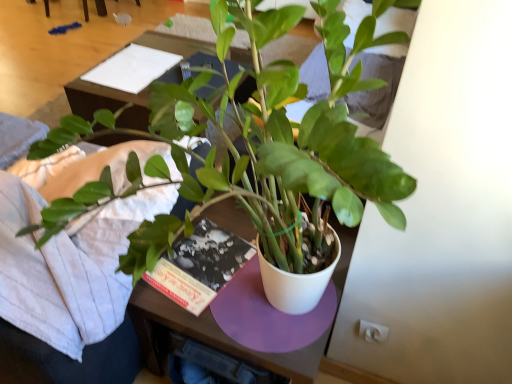
Question: From a real-world perspective, is white paper at upper center above or below green matte plant at center?

Choices:
 (A) above
 (B) below

Answer: (B)

Question: From the image's perspective, is white paper at upper center located above or below green matte plant at center?

Choices:
 (A) above
 (B) below

Answer: (A)

Question: Estimate the real-world distances between objects in this image. Which object is farther from the wooden table at center?

Choices:
 (A) white paper at upper center
 (B) green matte plant at center

Answer: (B)

Question: Based on their relative distances, which object is farther from the green matte plant at center?

Choices:
 (A) white paper at upper center
 (B) wooden table at center

Answer: (B)